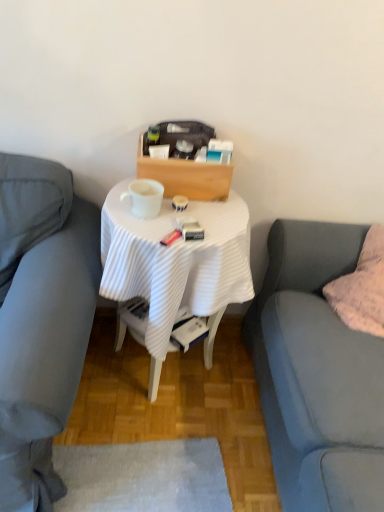
Question: From a real-world perspective, is soft gray fabric couch at right, marked as the first studio couch in a right-to-left arrangement, positioned under white ribbed cloth at center based on gravity?

Choices:
 (A) yes
 (B) no

Answer: (B)

Question: Can you confirm if soft gray fabric couch at right, the second studio couch in the left-to-right sequence, is wider than white ribbed cloth at center?

Choices:
 (A) no
 (B) yes

Answer: (A)

Question: Is soft gray fabric couch at right, the second studio couch in the left-to-right sequence, bigger than white ribbed cloth at center?

Choices:
 (A) no
 (B) yes

Answer: (B)

Question: Would you consider soft gray fabric couch at right, marked as the first studio couch in a right-to-left arrangement, to be distant from white ribbed cloth at center?

Choices:
 (A) yes
 (B) no

Answer: (B)

Question: Can you confirm if soft gray fabric couch at right, the second studio couch in the left-to-right sequence, is thinner than white ribbed cloth at center?

Choices:
 (A) no
 (B) yes

Answer: (B)

Question: Considering the relative sizes of soft gray fabric couch at right, marked as the first studio couch in a right-to-left arrangement, and white ribbed cloth at center in the image provided, is soft gray fabric couch at right, marked as the first studio couch in a right-to-left arrangement, smaller than white ribbed cloth at center?

Choices:
 (A) no
 (B) yes

Answer: (A)

Question: Can you see matte gray couch at left, placed as the 1th studio couch when sorted from left to right, touching soft gray fabric couch at right, marked as the first studio couch in a right-to-left arrangement?

Choices:
 (A) yes
 (B) no

Answer: (B)

Question: Can you confirm if matte gray couch at left, the second studio couch viewed from the right, is positioned to the left of soft gray fabric couch at right, the second studio couch in the left-to-right sequence?

Choices:
 (A) no
 (B) yes

Answer: (B)

Question: Is soft gray fabric couch at right, marked as the first studio couch in a right-to-left arrangement, at the back of matte gray couch at left, the second studio couch viewed from the right?

Choices:
 (A) no
 (B) yes

Answer: (A)

Question: From the image's perspective, is matte gray couch at left, the second studio couch viewed from the right, located beneath soft gray fabric couch at right, marked as the first studio couch in a right-to-left arrangement?

Choices:
 (A) no
 (B) yes

Answer: (A)

Question: From a real-world perspective, is matte gray couch at left, placed as the 1th studio couch when sorted from left to right, over soft gray fabric couch at right, the second studio couch in the left-to-right sequence?

Choices:
 (A) yes
 (B) no

Answer: (B)

Question: Is matte gray couch at left, placed as the 1th studio couch when sorted from left to right, taller than soft gray fabric couch at right, the second studio couch in the left-to-right sequence?

Choices:
 (A) yes
 (B) no

Answer: (B)

Question: From the image's perspective, is matte gray couch at left, the second studio couch viewed from the right, over white glossy mug at center?

Choices:
 (A) no
 (B) yes

Answer: (A)